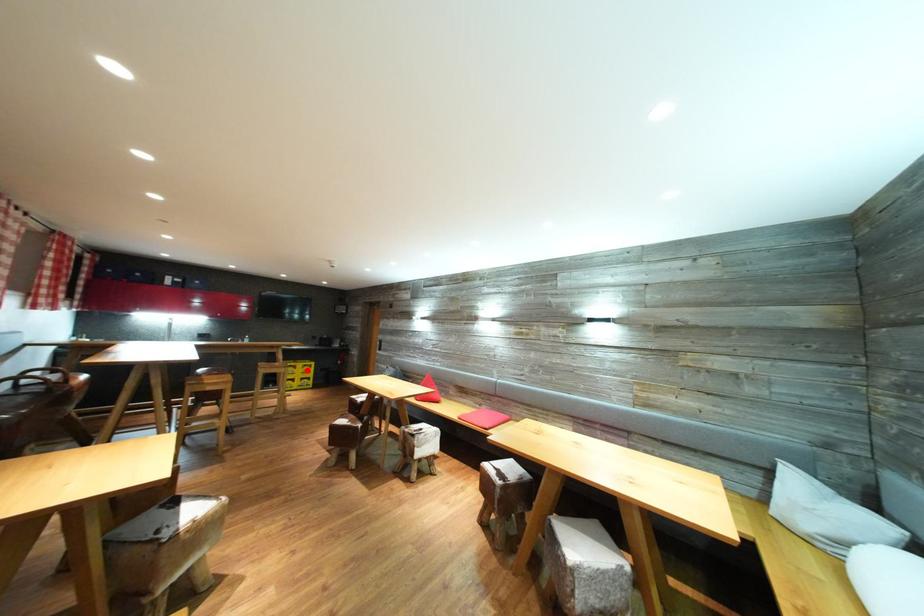
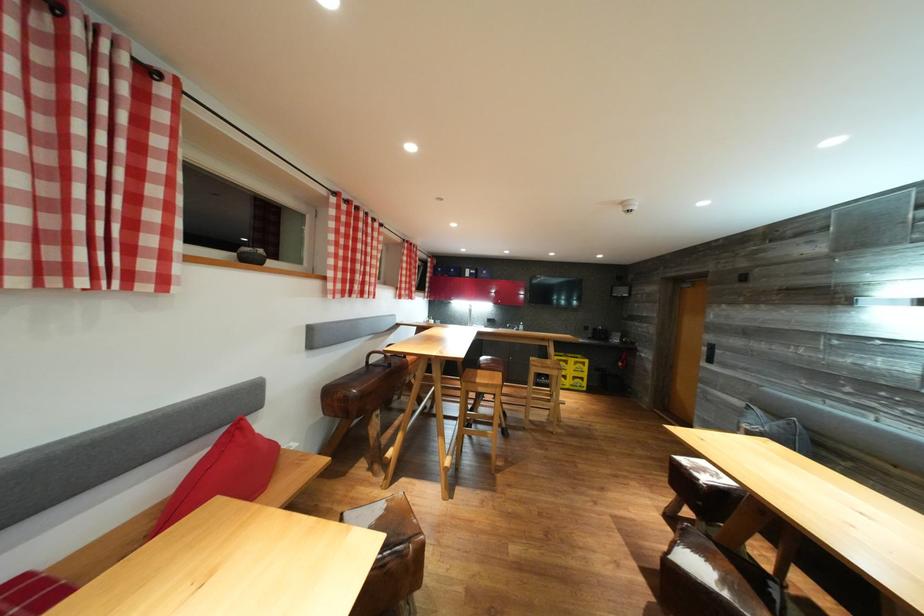
Question: I am providing you with two images of the same scene from different viewpoints. A red point is marked on the first image. Can you still see the location of the red point in image 2?

Choices:
 (A) Yes
 (B) No

Answer: (A)